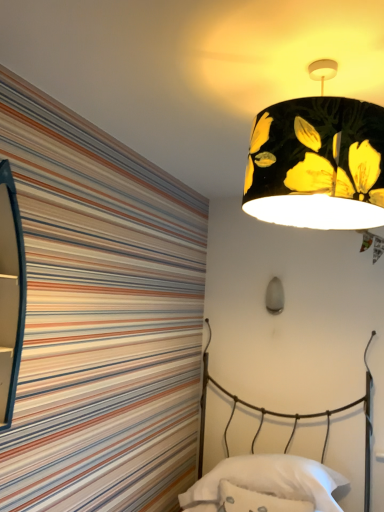
Question: From a real-world perspective, is white soft pillow at lower center physically located above or below black fabric lampshade at upper right, the first lamp from the top?

Choices:
 (A) above
 (B) below

Answer: (B)

Question: Based on their positions, is white soft pillow at lower center located to the left or right of black fabric lampshade at upper right, placed as the second lamp when sorted from back to front?

Choices:
 (A) left
 (B) right

Answer: (B)

Question: Which of these objects is positioned closest to the white soft pillow at lower center?

Choices:
 (A) black fabric lampshade at upper right, the first lamp from the top
 (B) matte gray bulb at center, the second lamp from the front
 (C) metallic wire bed at lower right
 (D) white fluffy throw pillow at lower center

Answer: (D)

Question: Which object is positioned closest to the metallic wire bed at lower right?

Choices:
 (A) black fabric lampshade at upper right, the 2th lamp in the bottom-to-top sequence
 (B) white soft pillow at lower center
 (C) matte gray bulb at center, acting as the first lamp starting from the back
 (D) white fluffy throw pillow at lower center

Answer: (B)